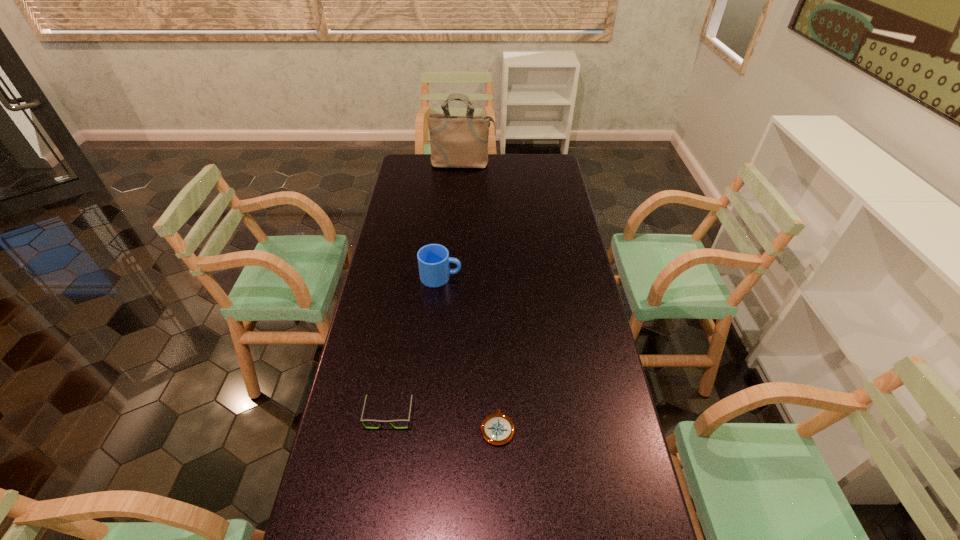
The height and width of the screenshot is (540, 960). What are the coordinates of `empty space that is in between the farthest object and the shortest object` in the screenshot? It's located at (480, 296).

Find the location of a particular element. The width and height of the screenshot is (960, 540). free space between the second tallest object and the second shortest object is located at coordinates (415, 346).

Where is `free space between the second tallest object and the compass`? The image size is (960, 540). free space between the second tallest object and the compass is located at coordinates (469, 353).

The width and height of the screenshot is (960, 540). In order to click on vacant point located between the compass and the second tallest object in this screenshot , I will do `click(469, 353)`.

Identify the location of empty space that is in between the second tallest object and the shortest object. Image resolution: width=960 pixels, height=540 pixels. (469, 353).

I want to click on empty location between the spectacles and the third shortest object, so pyautogui.click(x=415, y=346).

Identify the location of vacant space that's between the shortest object and the shoulder bag. Image resolution: width=960 pixels, height=540 pixels. (480, 296).

What are the coordinates of `object that is the third nearest to the tallest object` in the screenshot? It's located at (497, 429).

Identify which object is the closest to the shoulder bag. Please provide its 2D coordinates. Your answer should be formatted as a tuple, i.e. [(x, y)], where the tuple contains the x and y coordinates of a point satisfying the conditions above.

[(434, 262)]

At what (x,y) coordinates should I click in order to perform the action: click on vacant space that satisfies the following two spatial constraints: 1. on the side of the second tallest object with the handle; 2. on the right side of the compass. Please return your answer as a coordinate pair (x, y). Looking at the image, I should click on (427, 428).